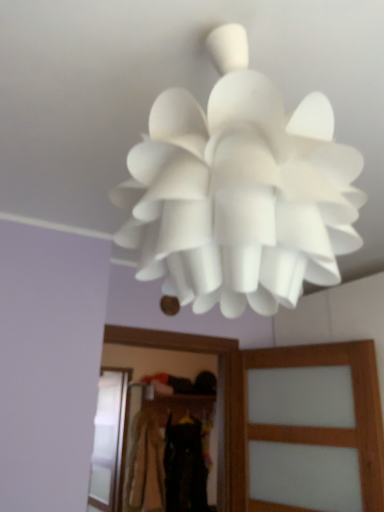
Question: Is translucent wood screen door at center, positioned as the first screen door in front-to-back order, wider or thinner than black fabric at center, which appears as the second clothing when viewed from the back?

Choices:
 (A) thin
 (B) wide

Answer: (A)

Question: Is translucent wood screen door at center, positioned as the first screen door in front-to-back order, spatially inside black fabric at center, which is the second clothing from front to back, or outside of it?

Choices:
 (A) inside
 (B) outside

Answer: (B)

Question: Which of these objects is positioned farthest from the dark brown fabric at center, the third clothing in the back-to-front sequence?

Choices:
 (A) translucent wood screen door at center, positioned as the first screen door in front-to-back order
 (B) white matte lampshade at center
 (C) light brown fabric at center, which is the 3th clothing from front to back
 (D) transparent glass screen door at lower left, which is the second screen door from front to back
 (E) black fabric at center, which appears as the second clothing when viewed from the back

Answer: (D)

Question: Which of these objects is positioned closest to the light brown fabric at center, which is the 3th clothing from front to back?

Choices:
 (A) translucent wood screen door at center, positioned as the first screen door in front-to-back order
 (B) white matte lampshade at center
 (C) black fabric at center, which appears as the second clothing when viewed from the back
 (D) dark brown fabric at center, acting as the 1th clothing starting from the front
 (E) transparent glass screen door at lower left, which is the second screen door from front to back

Answer: (C)